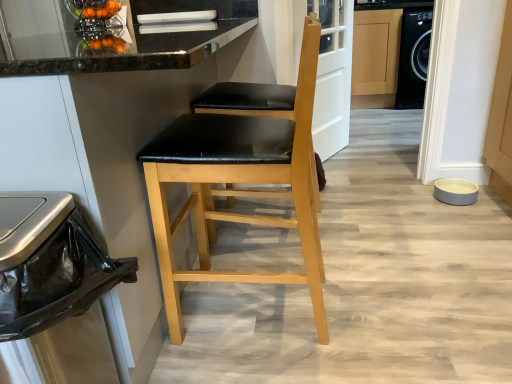
Question: From the image's perspective, does black leather chair at center, arranged as the first chair when viewed from the front, appear lower than matte wood cabinet at center?

Choices:
 (A) yes
 (B) no

Answer: (A)

Question: Is black leather chair at center, positioned as the second chair in back-to-front order, at the left side of matte wood cabinet at center?

Choices:
 (A) yes
 (B) no

Answer: (A)

Question: Is the depth of black leather chair at center, arranged as the first chair when viewed from the front, less than that of matte wood cabinet at center?

Choices:
 (A) no
 (B) yes

Answer: (B)

Question: Is black leather chair at center, positioned as the second chair in back-to-front order, outside of matte wood cabinet at center?

Choices:
 (A) no
 (B) yes

Answer: (B)

Question: Is black leather chair at center, positioned as the second chair in back-to-front order, looking in the opposite direction of matte wood cabinet at center?

Choices:
 (A) no
 (B) yes

Answer: (A)

Question: From the image's perspective, is black leather chair at center, arranged as the first chair when viewed from the front, above matte wood cabinet at center?

Choices:
 (A) no
 (B) yes

Answer: (A)

Question: From the image's perspective, is matte wood cabinet at center on matte black seat at center, which is counted as the 2th chair, starting from the front?

Choices:
 (A) yes
 (B) no

Answer: (A)

Question: From a real-world perspective, is matte wood cabinet at center positioned over matte black seat at center, which is counted as the 2th chair, starting from the front, based on gravity?

Choices:
 (A) no
 (B) yes

Answer: (B)

Question: Could you tell me if matte wood cabinet at center is facing matte black seat at center, the 1th chair from the back?

Choices:
 (A) yes
 (B) no

Answer: (A)

Question: Is matte wood cabinet at center to the left of matte black seat at center, which is counted as the 2th chair, starting from the front, from the viewer's perspective?

Choices:
 (A) no
 (B) yes

Answer: (A)

Question: Does matte wood cabinet at center have a lesser height compared to matte black seat at center, the 1th chair from the back?

Choices:
 (A) no
 (B) yes

Answer: (A)

Question: Considering the relative sizes of matte wood cabinet at center and matte black seat at center, the 1th chair from the back, in the image provided, is matte wood cabinet at center taller than matte black seat at center, the 1th chair from the back,?

Choices:
 (A) no
 (B) yes

Answer: (B)

Question: Considering the relative sizes of metallic trash can at left and matte black seat at center, which is counted as the 2th chair, starting from the front, in the image provided, is metallic trash can at left taller than matte black seat at center, which is counted as the 2th chair, starting from the front,?

Choices:
 (A) no
 (B) yes

Answer: (A)